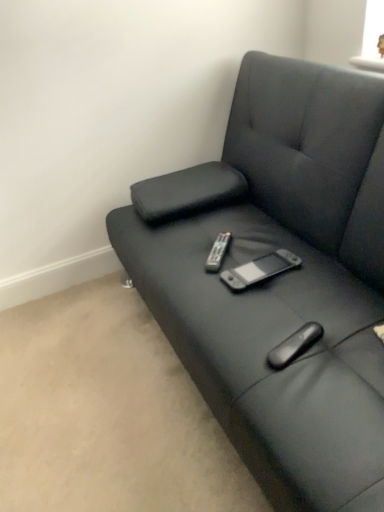
Question: Considering the relative sizes of black plastic remote at center and matte black couch at center in the image provided, is black plastic remote at center thinner than matte black couch at center?

Choices:
 (A) yes
 (B) no

Answer: (A)

Question: Is black plastic remote at center further to camera compared to matte black couch at center?

Choices:
 (A) yes
 (B) no

Answer: (A)

Question: Is black plastic remote at center at the right side of matte black couch at center?

Choices:
 (A) yes
 (B) no

Answer: (B)

Question: Is black plastic remote at center shorter than matte black couch at center?

Choices:
 (A) no
 (B) yes

Answer: (B)

Question: Does black plastic remote at center appear on the left side of matte black couch at center?

Choices:
 (A) no
 (B) yes

Answer: (B)

Question: Is black plastic remote at center closer to camera compared to matte black couch at center?

Choices:
 (A) no
 (B) yes

Answer: (A)

Question: From a real-world perspective, is matte black couch at center under black plastic remote at center?

Choices:
 (A) no
 (B) yes

Answer: (A)

Question: Is matte black couch at center at the right side of black plastic remote at center?

Choices:
 (A) no
 (B) yes

Answer: (B)

Question: From the image's perspective, is matte black couch at center below black plastic remote at center?

Choices:
 (A) yes
 (B) no

Answer: (B)

Question: Can you confirm if matte black couch at center is wider than black plastic remote at center?

Choices:
 (A) yes
 (B) no

Answer: (A)

Question: Is matte black couch at center taller than black plastic remote at center?

Choices:
 (A) yes
 (B) no

Answer: (A)

Question: Considering the relative sizes of matte black couch at center and black plastic remote at center in the image provided, is matte black couch at center shorter than black plastic remote at center?

Choices:
 (A) yes
 (B) no

Answer: (B)

Question: Looking at the image, does black plastic remote at center seem bigger or smaller compared to matte black couch at center?

Choices:
 (A) small
 (B) big

Answer: (A)